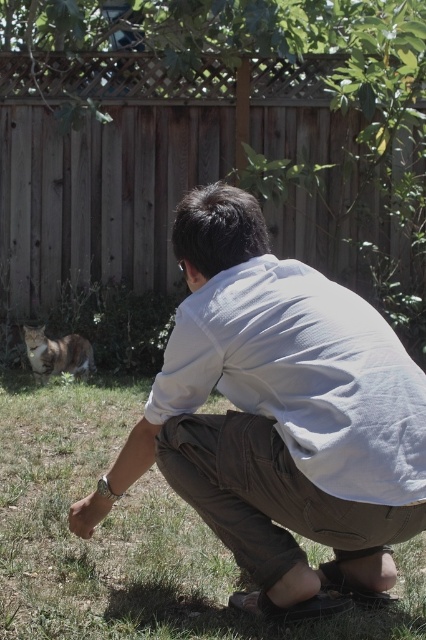
Question: Is white cotton shirt at center wider than tabby fur cat at lower left?

Choices:
 (A) no
 (B) yes

Answer: (B)

Question: Is white cotton shirt at center in front of green grass at lower center?

Choices:
 (A) yes
 (B) no

Answer: (A)

Question: Which of the following is the closest to the observer?

Choices:
 (A) (388, 433)
 (B) (80, 353)
 (C) (198, 627)

Answer: (A)

Question: Which is farther from the white cotton shirt at center?

Choices:
 (A) tabby fur cat at lower left
 (B) green grass at lower center

Answer: (A)

Question: Can you confirm if white cotton shirt at center is bigger than tabby fur cat at lower left?

Choices:
 (A) yes
 (B) no

Answer: (A)

Question: Which object is the farthest from the white cotton shirt at center?

Choices:
 (A) green grass at lower center
 (B) tabby fur cat at lower left

Answer: (B)